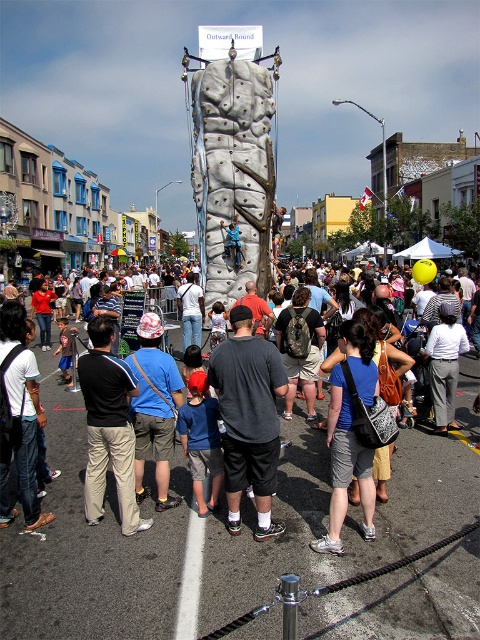
Question: In this image, where is matte gray climbing wall at center located relative to denim shorts at center?

Choices:
 (A) right
 (B) left

Answer: (B)

Question: Does matte gray climbing wall at center appear on the left side of denim shorts at center?

Choices:
 (A) no
 (B) yes

Answer: (B)

Question: Which of the following is the closest to the observer?

Choices:
 (A) (364, 387)
 (B) (244, 426)
 (C) (193, 166)

Answer: (B)

Question: Estimate the real-world distances between objects in this image. Which object is farther from the denim shorts at center?

Choices:
 (A) dark gray fabric shorts at center
 (B) matte gray climbing wall at center

Answer: (B)

Question: Does matte gray climbing wall at center appear on the right side of denim shorts at center?

Choices:
 (A) yes
 (B) no

Answer: (B)

Question: Which object is farther from the camera taking this photo?

Choices:
 (A) dark gray fabric shorts at center
 (B) matte gray climbing wall at center
 (C) denim shorts at center

Answer: (A)